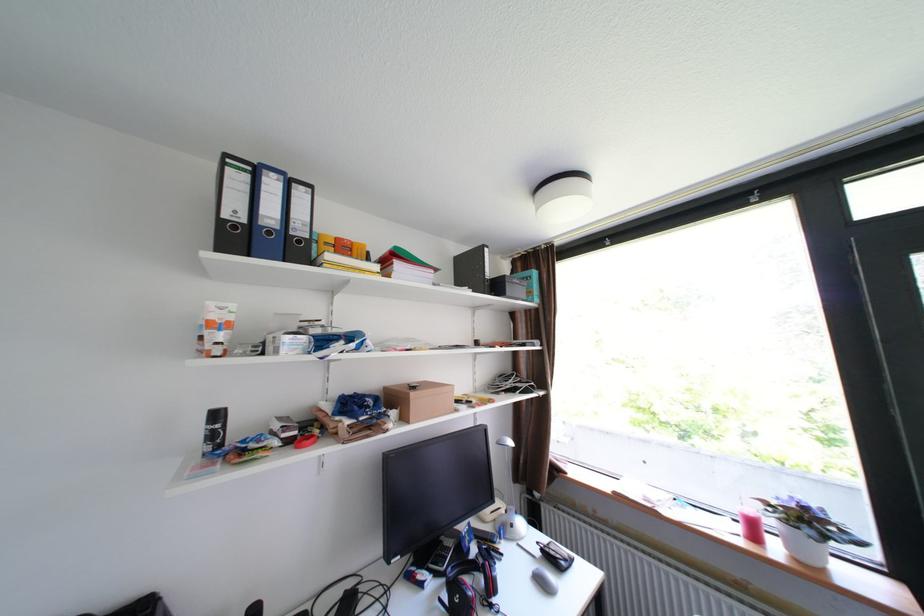
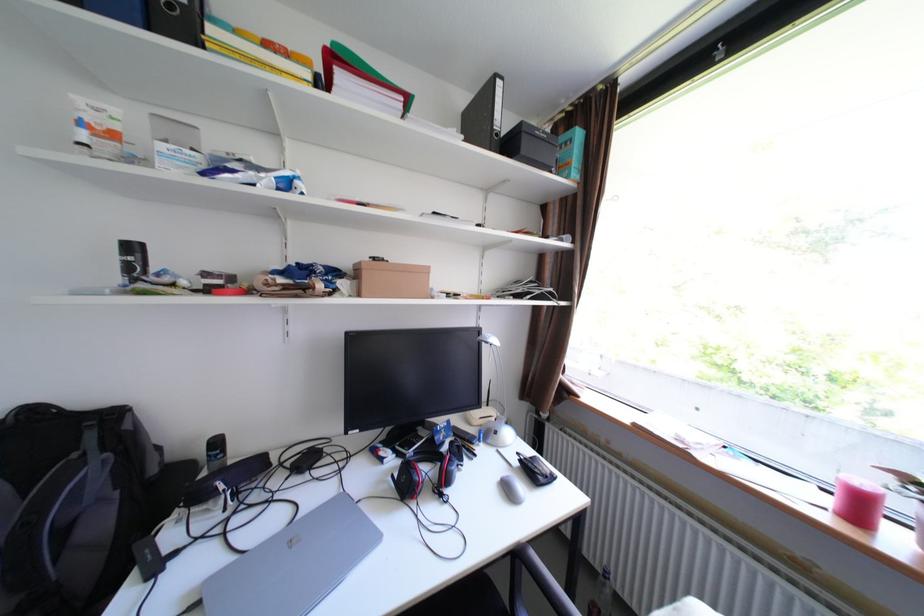
The point at (760, 512) is marked in the first image. Where is the corresponding point in the second image?

(874, 484)